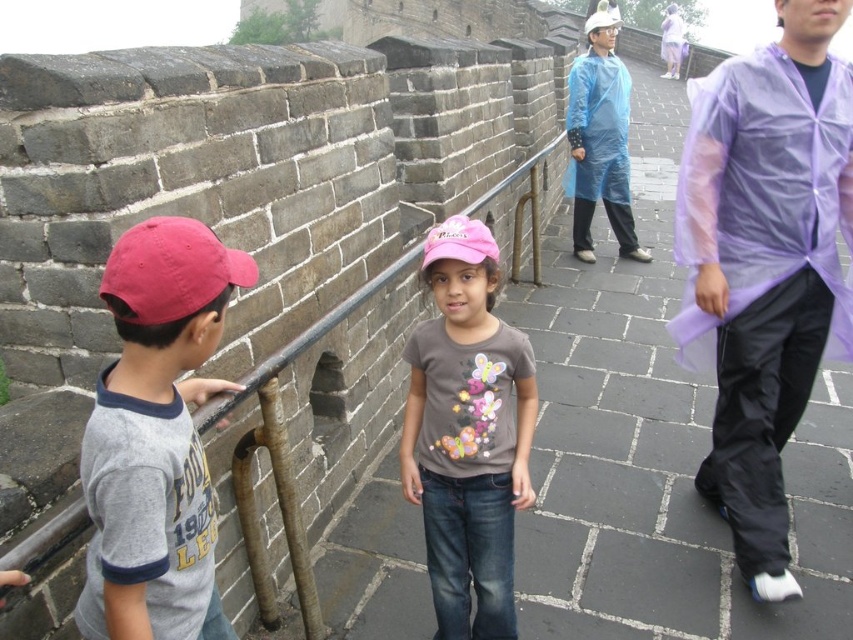
You are standing on the Great Wall of China and want to walk from the starting point to the destination. The starting point is at point (171,314) and the destination is at point (250,481). Which direction should you move to reach the destination?

Since point (171,314) is in front of point (250,481), you should move backward to reach the destination.

You are a visitor on the Great Wall and see the transparent purple raincoat at right and the pink fabric cap at center. Which object is higher up in the scene?

The transparent purple raincoat at right is above the pink fabric cap at center, so it is higher up in the scene.